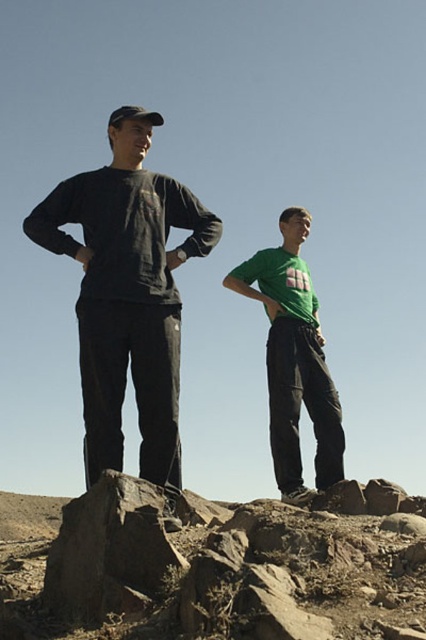
Question: Is rusty rock at center thinner than matte black sweatshirt at center?

Choices:
 (A) yes
 (B) no

Answer: (A)

Question: Can you confirm if matte black sweatshirt at center is bigger than green matte shirt at center?

Choices:
 (A) yes
 (B) no

Answer: (B)

Question: Does rusty rock at center lie behind matte black sweatshirt at center?

Choices:
 (A) no
 (B) yes

Answer: (A)

Question: Which object appears farthest from the camera in this image?

Choices:
 (A) matte black sweatshirt at center
 (B) green matte shirt at center

Answer: (B)

Question: Which of the following is the farthest from the observer?

Choices:
 (A) green matte shirt at center
 (B) rusty rock at center

Answer: (A)

Question: Which point is farther to the camera?

Choices:
 (A) (324, 428)
 (B) (199, 525)
 (C) (121, 355)

Answer: (A)